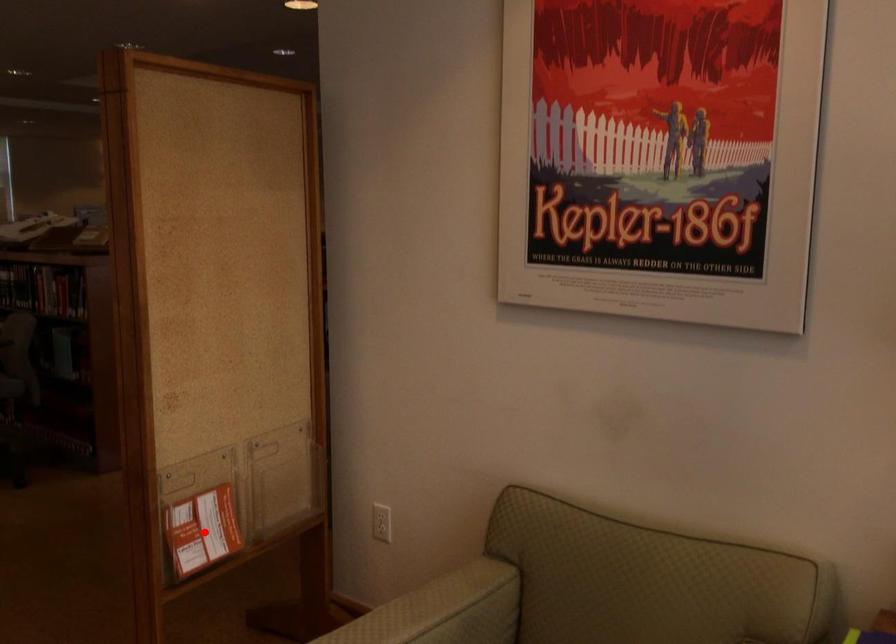
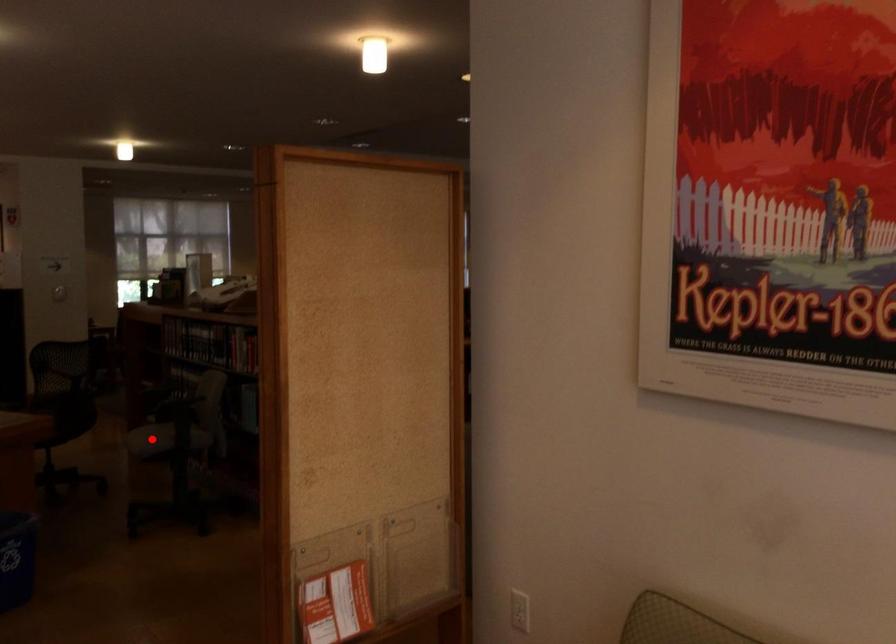
I am providing you with two images of the same scene from different viewpoints. A red point is marked on the first image and another point is marked on the second image. Is the marked point in image1 the same physical position as the marked point in image2?

No